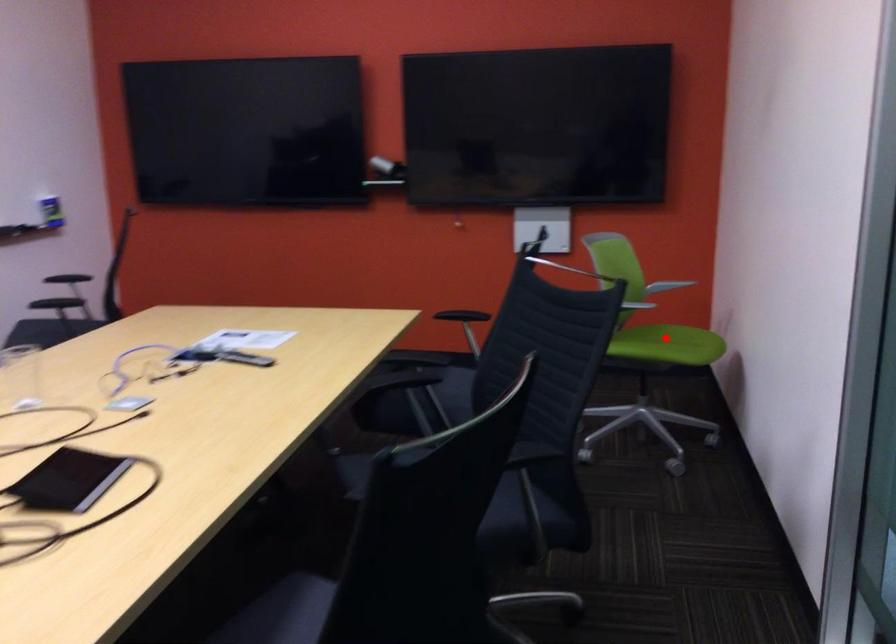
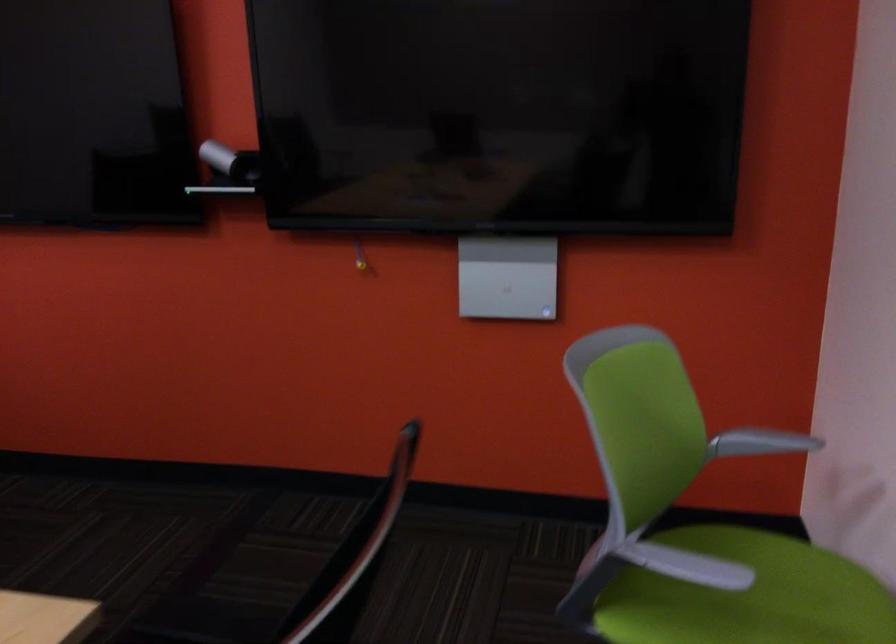
Question: I am providing you with two images of the same scene from different viewpoints. A red point is shown in image1. For the corresponding object point in image2, is it positioned nearer or farther from the camera?

Choices:
 (A) Nearer
 (B) Farther

Answer: (A)